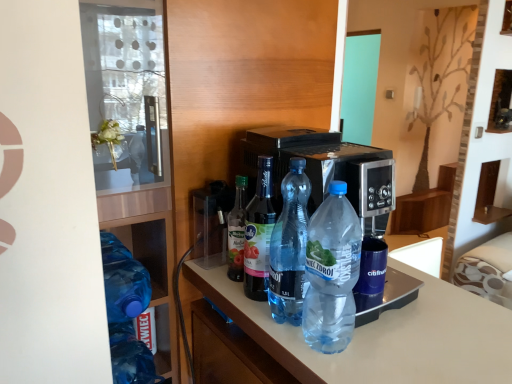
Question: Could translucent plastic bottle at center, which is the second bottle in left-to-right order, be considered to be inside transparent plastic bottle at center, which appears as the fifth bottle when viewed from the left?

Choices:
 (A) yes
 (B) no

Answer: (B)

Question: Does transparent plastic bottle at center, which appears as the fifth bottle when viewed from the left, appear on the left side of translucent plastic bottle at center, placed as the 4th bottle when sorted from right to left?

Choices:
 (A) yes
 (B) no

Answer: (B)

Question: From the image's perspective, would you say transparent plastic bottle at center, the 1th bottle viewed from the right, is positioned over translucent plastic bottle at center, placed as the 4th bottle when sorted from right to left?

Choices:
 (A) no
 (B) yes

Answer: (A)

Question: Is transparent plastic bottle at center, the 1th bottle viewed from the right, thinner than translucent plastic bottle at center, placed as the 4th bottle when sorted from right to left?

Choices:
 (A) no
 (B) yes

Answer: (A)

Question: Is transparent plastic bottle at center, which appears as the fifth bottle when viewed from the left, bigger than translucent plastic bottle at center, which is the second bottle in left-to-right order?

Choices:
 (A) no
 (B) yes

Answer: (B)

Question: Is clear plastic bottle at center, which appears as the 3th bottle when viewed from the right, spatially inside blue translucent bottle at left, which appears as the first bottle when viewed from the left, or outside of it?

Choices:
 (A) inside
 (B) outside

Answer: (B)

Question: From a real-world perspective, is clear plastic bottle at center, marked as the 3th bottle in a left-to-right arrangement, above or below blue translucent bottle at left, which is the 5th bottle from right to left?

Choices:
 (A) above
 (B) below

Answer: (A)

Question: Considering the positions of clear plastic bottle at center, which appears as the 3th bottle when viewed from the right, and blue translucent bottle at left, which is the 5th bottle from right to left, in the image, is clear plastic bottle at center, which appears as the 3th bottle when viewed from the right, taller or shorter than blue translucent bottle at left, which is the 5th bottle from right to left,?

Choices:
 (A) tall
 (B) short

Answer: (A)

Question: Considering the positions of clear plastic bottle at center, which appears as the 3th bottle when viewed from the right, and blue translucent bottle at left, which appears as the first bottle when viewed from the left, in the image, is clear plastic bottle at center, which appears as the 3th bottle when viewed from the right, wider or thinner than blue translucent bottle at left, which appears as the first bottle when viewed from the left,?

Choices:
 (A) wide
 (B) thin

Answer: (B)

Question: Is point (159, 187) closer or farther from the camera than point (246, 266)?

Choices:
 (A) farther
 (B) closer

Answer: (A)

Question: Considering the positions of transparent plastic bottles at left and clear plastic bottle at center, which appears as the 3th bottle when viewed from the right, in the image, is transparent plastic bottles at left taller or shorter than clear plastic bottle at center, which appears as the 3th bottle when viewed from the right,?

Choices:
 (A) short
 (B) tall

Answer: (B)

Question: Based on their sizes in the image, would you say transparent plastic bottles at left is bigger or smaller than clear plastic bottle at center, marked as the 3th bottle in a left-to-right arrangement?

Choices:
 (A) big
 (B) small

Answer: (A)

Question: In the image, is transparent plastic bottles at left on the left side or the right side of clear plastic bottle at center, which appears as the 3th bottle when viewed from the right?

Choices:
 (A) right
 (B) left

Answer: (B)

Question: Considering the positions of transparent plastic bottle at center, which appears as the fourth bottle when viewed from the left, and clear plastic bottle at center, which appears as the 3th bottle when viewed from the right, in the image, is transparent plastic bottle at center, which appears as the fourth bottle when viewed from the left, bigger or smaller than clear plastic bottle at center, which appears as the 3th bottle when viewed from the right,?

Choices:
 (A) big
 (B) small

Answer: (B)

Question: Is transparent plastic bottle at center, which appears as the fourth bottle when viewed from the left, taller or shorter than clear plastic bottle at center, marked as the 3th bottle in a left-to-right arrangement?

Choices:
 (A) short
 (B) tall

Answer: (B)